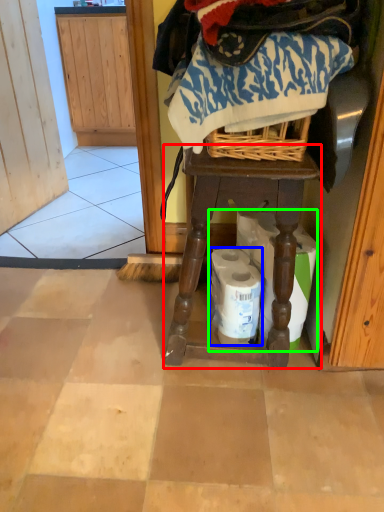
Question: Based on their relative distances, which object is nearer to furniture (highlighted by a red box)? Choose from toilet paper (highlighted by a blue box) and toilet paper (highlighted by a green box).

Choices:
 (A) toilet paper
 (B) toilet paper

Answer: (B)